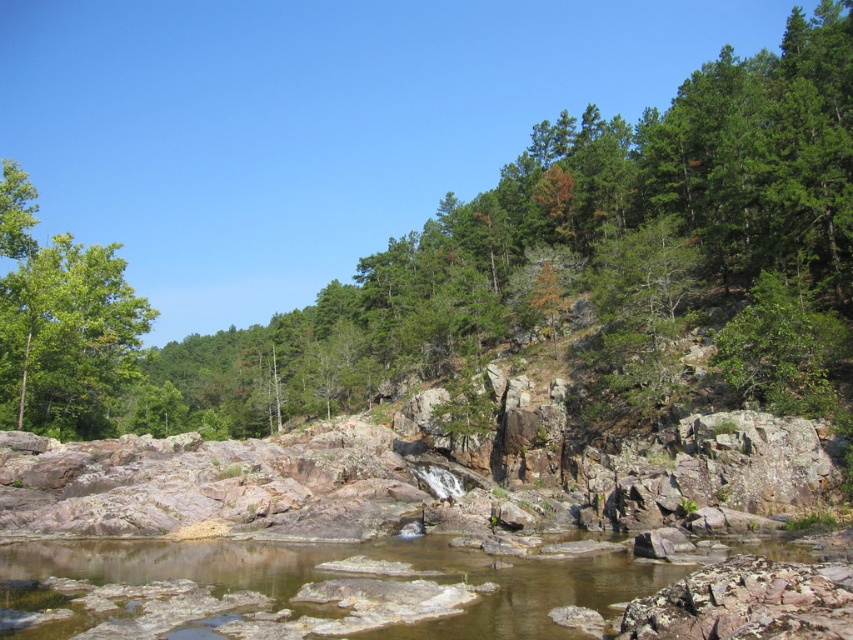
You are standing at the base of the rocky hillside and see the green leafy tree at upper center and the green leafy tree at left. Which tree is positioned higher up in the scene?

The green leafy tree at upper center is positioned higher up in the scene than the green leafy tree at left.

In the scene shown: You are standing at the base of the rocky hillside and notice two green leafy trees in the scene. Which tree, the green leafy tree at upper center or the green leafy tree at left, is positioned to the right when viewed from your perspective?

The green leafy tree at upper center is positioned to the right of the green leafy tree at left.

You are a hiker planning to walk from the green leafy tree at upper center to the green leafy tree at left. The trail is straight and clear. If your average walking speed is 3.5 km per hour, how many minutes will it take you to reach the second tree?

The distance between the green leafy tree at upper center and the green leafy tree at left is 67.67 meters. Converting meters to kilometers, 67.67 meters equals 0.06767 kilometers. Dividing the distance by your walking speed of 3.5 km per hour gives approximately 0.0193 hours. Multiplying by 60 minutes per hour results in roughly 1.16 minutes. Therefore, it will take about 1 minute and 8 seconds to reach the green leafy tree at left.